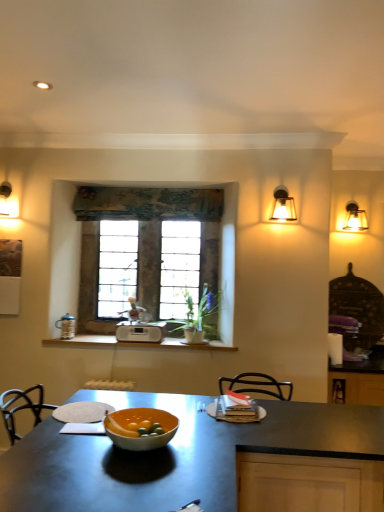
Question: Is stone textured window at center positioned behind textured fabric curtain at center?

Choices:
 (A) no
 (B) yes

Answer: (B)

Question: From a real-world perspective, is stone textured window at center located higher than textured fabric curtain at center?

Choices:
 (A) no
 (B) yes

Answer: (A)

Question: Is textured fabric curtain at center at the back of stone textured window at center?

Choices:
 (A) yes
 (B) no

Answer: (A)

Question: Could you tell me if stone textured window at center is turned towards textured fabric curtain at center?

Choices:
 (A) no
 (B) yes

Answer: (B)

Question: Is stone textured window at center far from textured fabric curtain at center?

Choices:
 (A) no
 (B) yes

Answer: (A)

Question: Considering the relative sizes of stone textured window at center and textured fabric curtain at center in the image provided, is stone textured window at center smaller than textured fabric curtain at center?

Choices:
 (A) no
 (B) yes

Answer: (A)

Question: From a real-world perspective, is matte glass sconce at upper right positioned over matte orange bowl at center based on gravity?

Choices:
 (A) no
 (B) yes

Answer: (B)

Question: From the image's perspective, is matte glass sconce at upper right below matte orange bowl at center?

Choices:
 (A) yes
 (B) no

Answer: (B)

Question: Is matte orange bowl at center completely or partially inside matte glass sconce at upper right?

Choices:
 (A) no
 (B) yes

Answer: (A)

Question: Considering the relative sizes of matte glass sconce at upper right and matte orange bowl at center in the image provided, is matte glass sconce at upper right shorter than matte orange bowl at center?

Choices:
 (A) no
 (B) yes

Answer: (A)

Question: Does matte glass sconce at upper right have a greater height compared to matte orange bowl at center?

Choices:
 (A) yes
 (B) no

Answer: (A)

Question: Is matte glass sconce at upper right further to the viewer compared to matte orange bowl at center?

Choices:
 (A) no
 (B) yes

Answer: (B)

Question: Is matte orange bowl at center to the right of white plastic radio at center from the viewer's perspective?

Choices:
 (A) no
 (B) yes

Answer: (B)